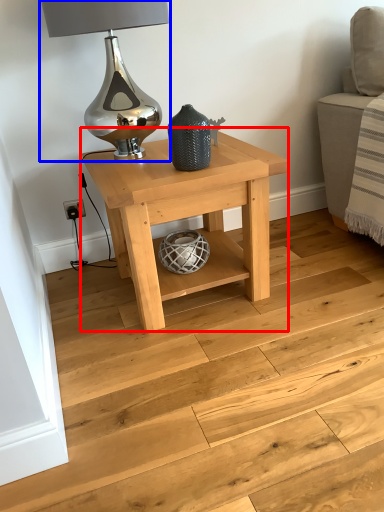
Question: Among these objects, which one is farthest to the camera, table (highlighted by a red box) or table lamp (highlighted by a blue box)?

Choices:
 (A) table
 (B) table lamp

Answer: (A)